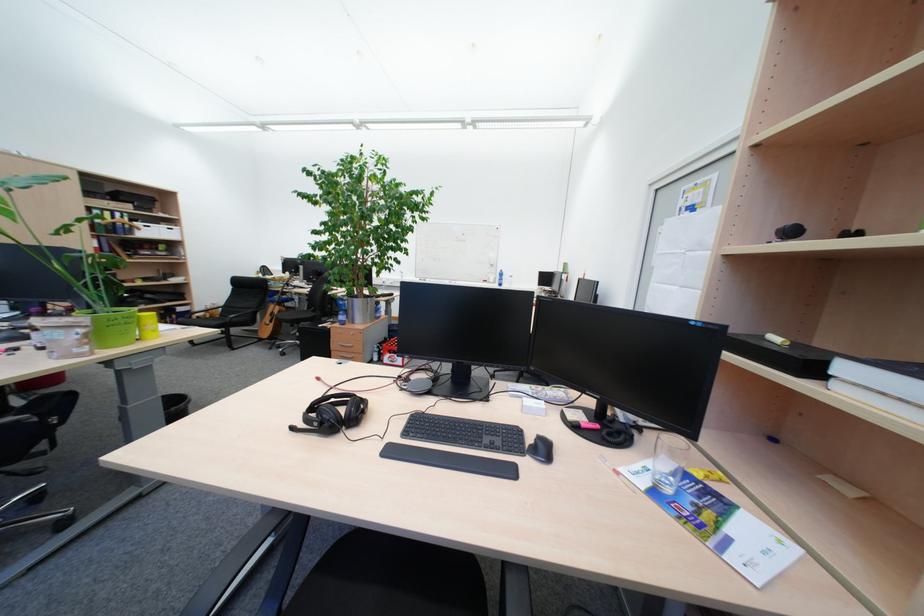
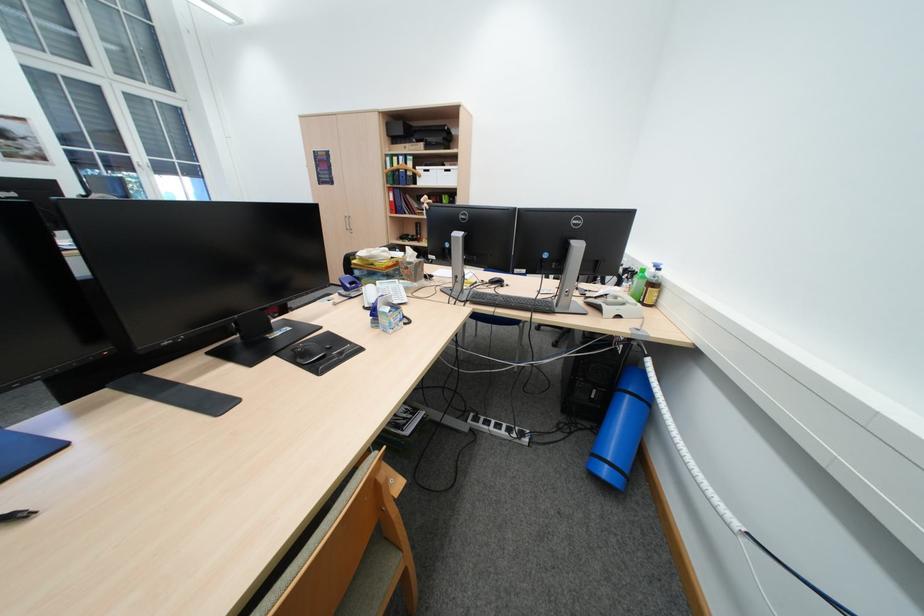
In the second image, find the point that corresponds to [124,213] in the first image.

(409, 156)